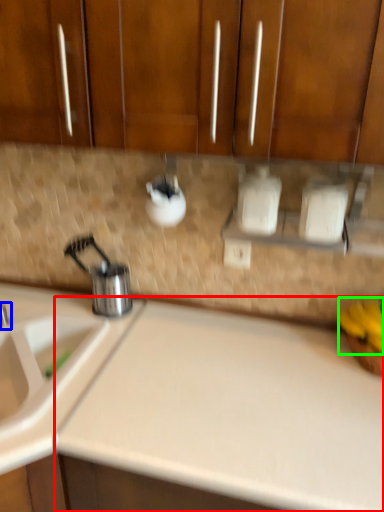
Question: Which is farther away from counter top (highlighted by a red box)? tap (highlighted by a blue box) or banana (highlighted by a green box)?

Choices:
 (A) tap
 (B) banana

Answer: (A)